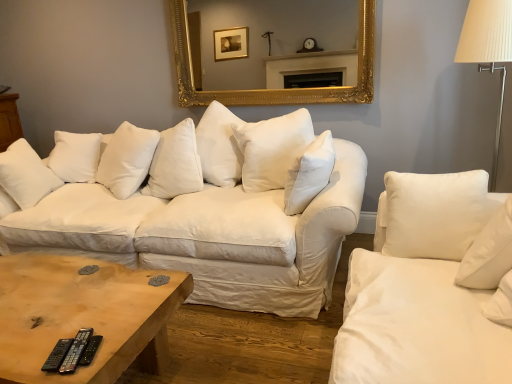
The image size is (512, 384). In order to click on unoccupied space behind black plastic remote at lower left, which ranks as the 2th remote in left-to-right order in this screenshot , I will do `click(109, 314)`.